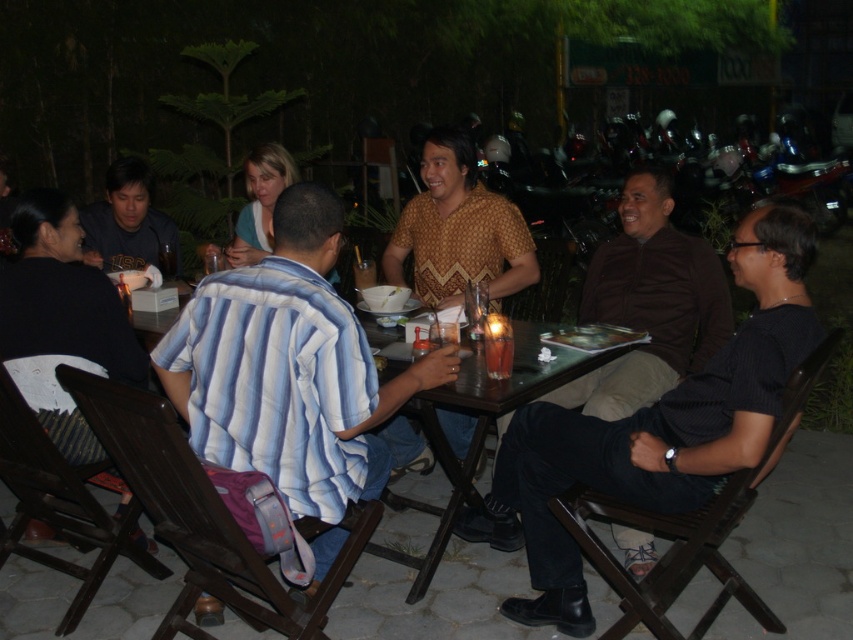
You are a waiter at this outdoor table and need to deliver a drink to the person wearing the dark brown shirt at center. The drink is in the translucent plastic cup at table center. Can you reach the cup without moving any other items on the table?

The dark brown shirt at center is further to the viewer than the translucent plastic cup at table center, so the cup is closer to you. Therefore, you can easily reach the translucent plastic cup at table center without moving other items.

You are a photographer standing at a distance. You want to take a photo of the blue striped shirt at center. Can you get a clear photo of it without zooming in?

The blue striped shirt at center is 2.01 meters away from the camera. Assuming an average camera can focus clearly up to 2 meters, the shirt is slightly out of the optimal range, so you might need to zoom in or move closer for a clearer photo.